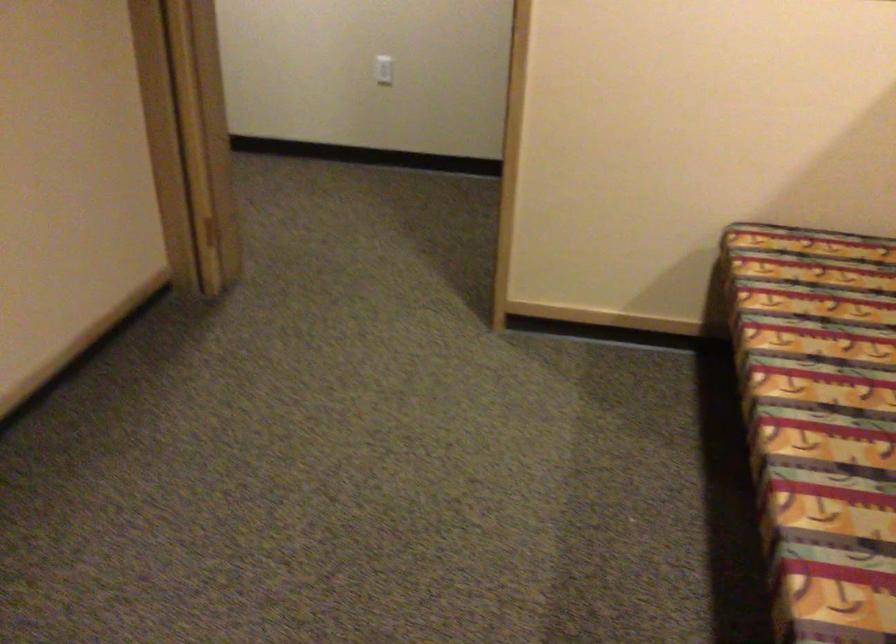
Image resolution: width=896 pixels, height=644 pixels. What do you see at coordinates (819, 422) in the screenshot?
I see `a patterned sofa surface` at bounding box center [819, 422].